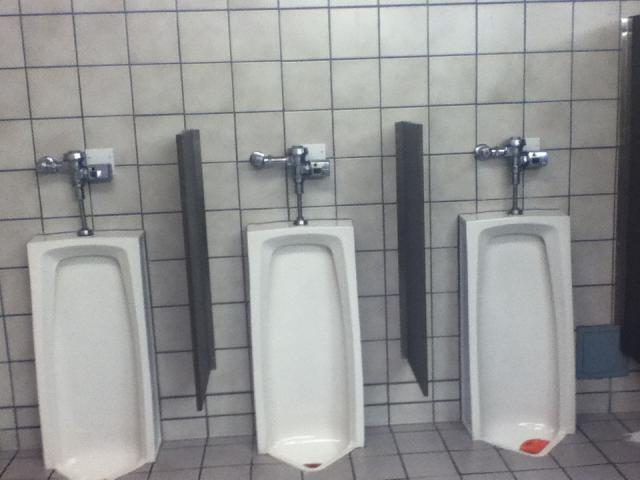
At what (x,y) coordinates should I click in order to perform the action: click on steel knob. Please return your answer as a coordinate pair (x, y). The image size is (640, 480). Looking at the image, I should click on (74, 163).